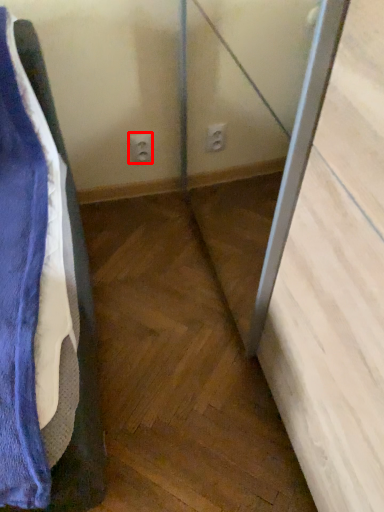
Question: From the image's perspective, considering the relative positions of electric outlet (annotated by the red box) and screen door in the image provided, where is electric outlet (annotated by the red box) located with respect to the staircase?

Choices:
 (A) below
 (B) above

Answer: (B)